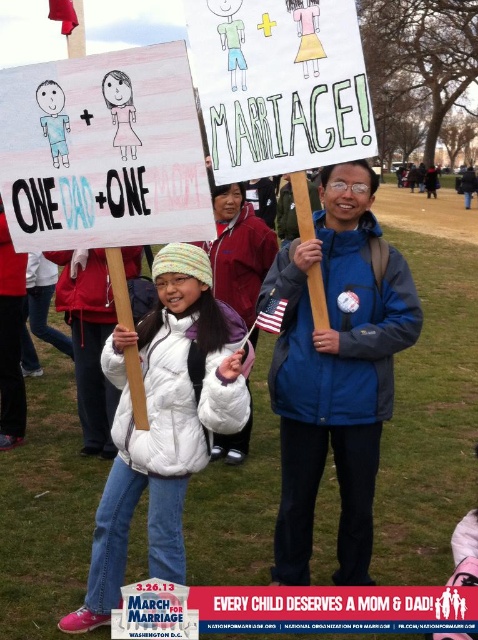
You are a photographer trying to capture a photo of the blue fabric jacket at center and the white puffy coat at center. Which one should you zoom in on to ensure it fits better in your frame?

The white puffy coat at center is wider than the blue fabric jacket at center, so you should zoom in on the blue fabric jacket at center to ensure it fits better in your frame.

You are a photographer at the rally and want to capture both the blue fabric jacket at center and the white puffy coat at center in a single frame. Given that the camera lens can only focus on one subject at a time, which subject should you focus on to ensure the other remains in the background without blurring?

The blue fabric jacket at center is larger in size compared to the white puffy coat at center. To keep both in focus, focus on the blue fabric jacket at center since it is larger and closer to the camera, ensuring the white puffy coat at center stays in the background without blurring.

You are a photographer at the rally and want to capture both the blue fabric jacket at center and the white puffy coat at center in a single photo. Which jacket is on the left side when facing the crowd?

The white puffy coat at center is on the left side because the blue fabric jacket at center is positioned on the right side of it.